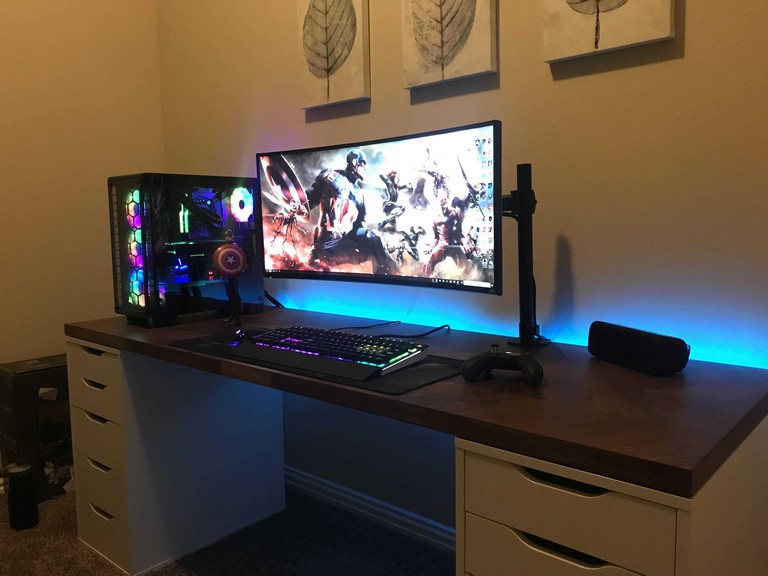
You are a GUI agent. You are given a task and a screenshot of the screen. Output one action in this format:
    pyautogui.click(x=<x>, y=<y>)
    Task: Click on the color in the gamers keyboard
    The height and width of the screenshot is (576, 768).
    Given the screenshot: What is the action you would take?
    pyautogui.click(x=372, y=362)